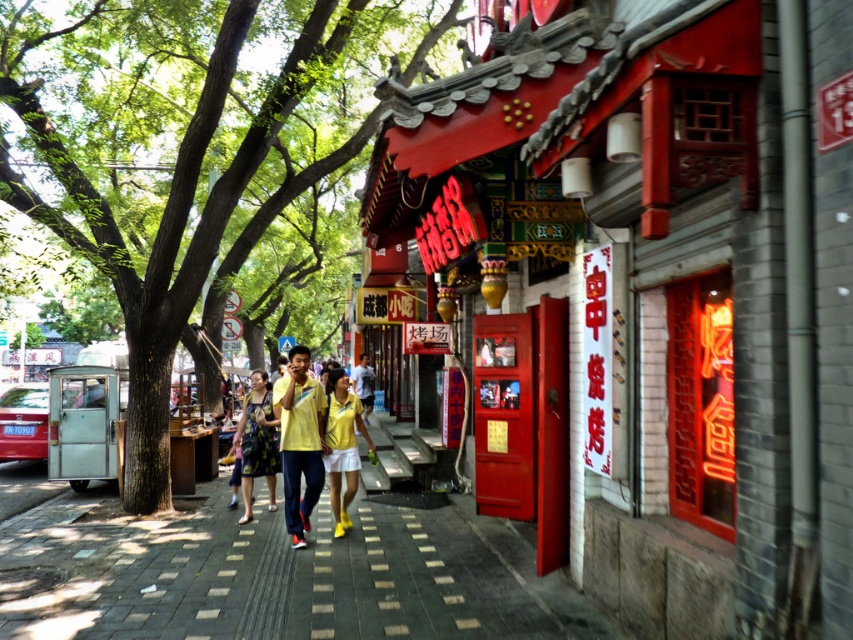
Question: Is yellow fabric pants at center to the right of yellow fabric shirt at center from the viewer's perspective?

Choices:
 (A) no
 (B) yes

Answer: (A)

Question: Which point is farther from the camera taking this photo?

Choices:
 (A) (349, 500)
 (B) (350, 86)
 (C) (347, 410)
 (D) (531, 385)

Answer: (B)

Question: Considering the real-world distances, which object is farthest from the printed fabric dress at center?

Choices:
 (A) yellow fabric pants at center
 (B) smooth concrete pavement at center
 (C) green leafy tree at left
 (D) yellow fabric shirt at center

Answer: (C)

Question: Which object is positioned closest to the yellow fabric shirt at center?

Choices:
 (A) smooth concrete pavement at center
 (B) printed fabric dress at center
 (C) yellow fabric couple at center
 (D) red painted wooden door at center

Answer: (C)

Question: Can you confirm if green leafy tree at left is smaller than printed fabric dress at center?

Choices:
 (A) no
 (B) yes

Answer: (A)

Question: Does red painted wooden door at center lie in front of yellow fabric couple at center?

Choices:
 (A) yes
 (B) no

Answer: (A)